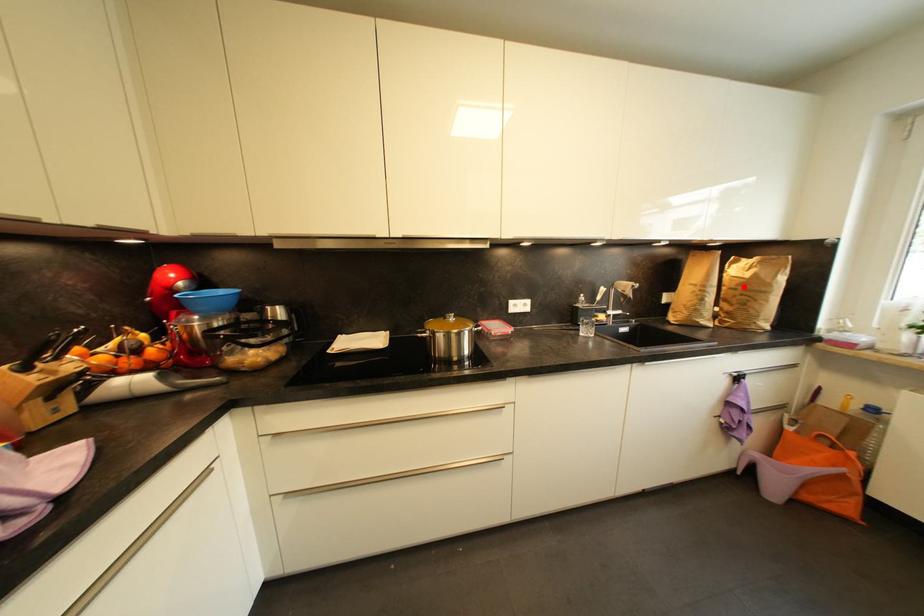
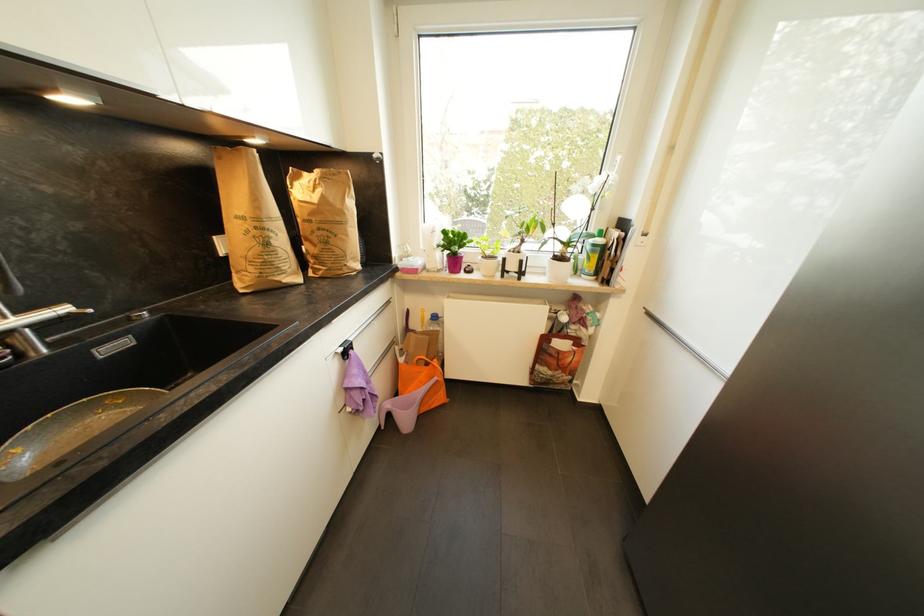
Where in the second image is the point corresponding to the highlighted location from the first image?

(317, 216)